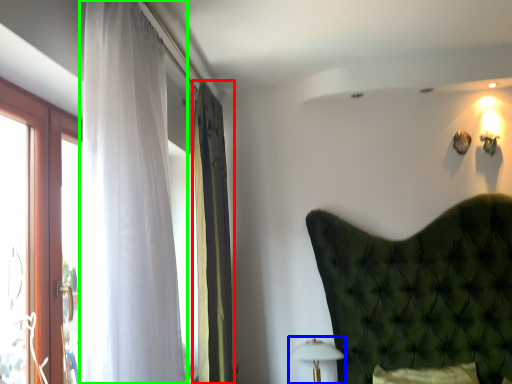
Question: Based on their relative distances, which object is nearer to curtain (highlighted by a red box)? Choose from table lamp (highlighted by a blue box) and curtain (highlighted by a green box).

Choices:
 (A) table lamp
 (B) curtain

Answer: (A)